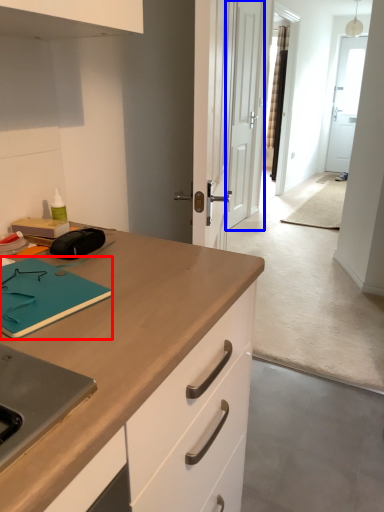
Question: Among these objects, which one is nearest to the camera, notepad (highlighted by a red box) or door (highlighted by a blue box)?

Choices:
 (A) notepad
 (B) door

Answer: (A)